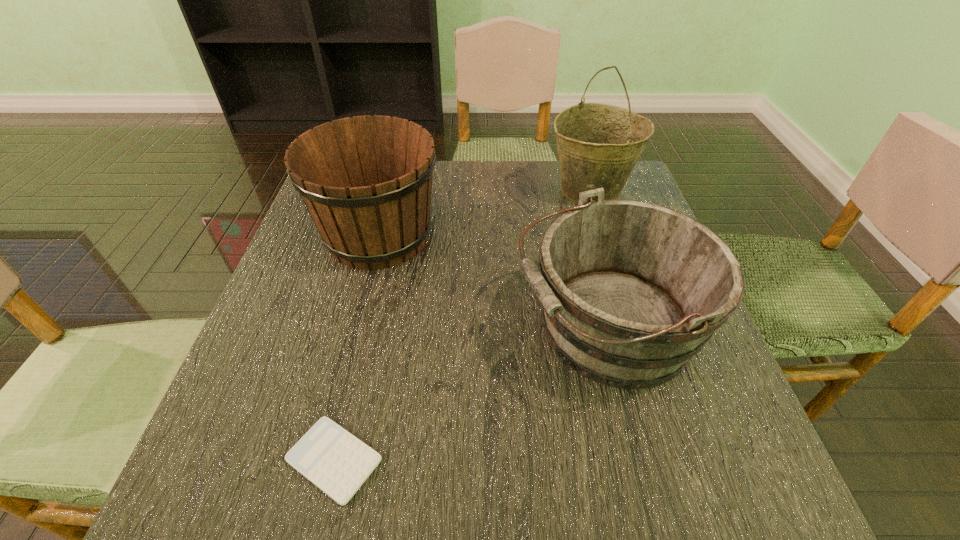
Identify the location of object present at the far left corner. (366, 181).

The width and height of the screenshot is (960, 540). I want to click on object that is at the near left corner, so click(337, 462).

The image size is (960, 540). Find the location of `object at the far right corner`. object at the far right corner is located at coordinates (598, 144).

This screenshot has height=540, width=960. I want to click on vacant region at the far edge, so click(529, 177).

The height and width of the screenshot is (540, 960). In the image, there is a desktop. Identify the location of free space at the near edge. (303, 501).

The width and height of the screenshot is (960, 540). I want to click on vacant space at the left edge, so click(361, 273).

Image resolution: width=960 pixels, height=540 pixels. In the image, there is a desktop. Identify the location of vacant space at the right edge. [709, 363].

Identify the location of vacant region at the near right corner of the desktop. This screenshot has height=540, width=960. (755, 478).

This screenshot has height=540, width=960. Identify the location of vacant space that is in between the tallest wine bucket and the leftmost wine bucket. (485, 213).

At what (x,y) coordinates should I click in order to perform the action: click on vacant space that's between the tallest object and the leftmost wine bucket. Please return your answer as a coordinate pair (x, y). Looking at the image, I should click on (485, 213).